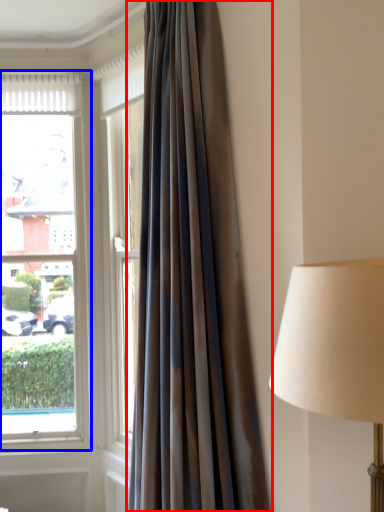
Question: Which of the following is the farthest to the observer, curtain (highlighted by a red box) or window (highlighted by a blue box)?

Choices:
 (A) curtain
 (B) window

Answer: (B)